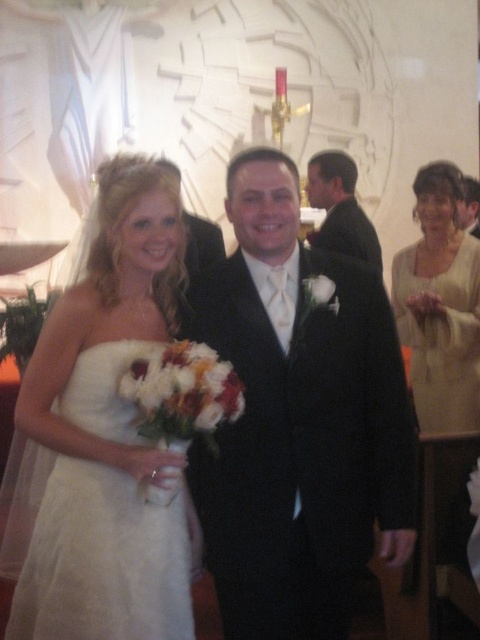
Which is behind, point (368, 241) or point (474, 224)?

Point (474, 224)

Is point (357, 220) positioned before point (460, 196)?

No, (357, 220) is further to viewer.

Does point (362, 243) come farther from viewer compared to point (478, 234)?

No, (362, 243) is in front of (478, 234).

Find the location of `matte black suit at upper center`. matte black suit at upper center is located at coordinates (339, 209).

Is matte cream blouse at right to the right of ivory satin dress at right from the viewer's perspective?

Incorrect, matte cream blouse at right is not on the right side of ivory satin dress at right.

Is matte cream blouse at right wider than ivory satin dress at right?

No, matte cream blouse at right is not wider than ivory satin dress at right.

What do you see at coordinates (436, 369) in the screenshot? I see `matte cream blouse at right` at bounding box center [436, 369].

Find the location of `matte cream blouse at right`. matte cream blouse at right is located at coordinates (436, 369).

Is point (333, 317) positioned in front of point (61, 433)?

No, (333, 317) is behind (61, 433).

Consider the image. Can you confirm if black satin suit at center is positioned to the left of white satin dress at left?

In fact, black satin suit at center is to the right of white satin dress at left.

The height and width of the screenshot is (640, 480). Identify the location of black satin suit at center. (298, 420).

What are the coordinates of `black satin suit at center` in the screenshot? It's located at (298, 420).